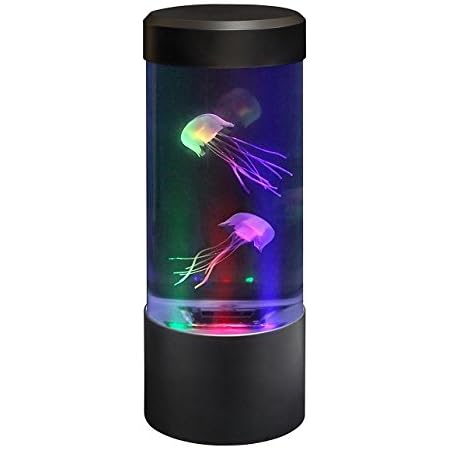
This screenshot has height=450, width=450. I want to click on dark purple light, so click(279, 315).